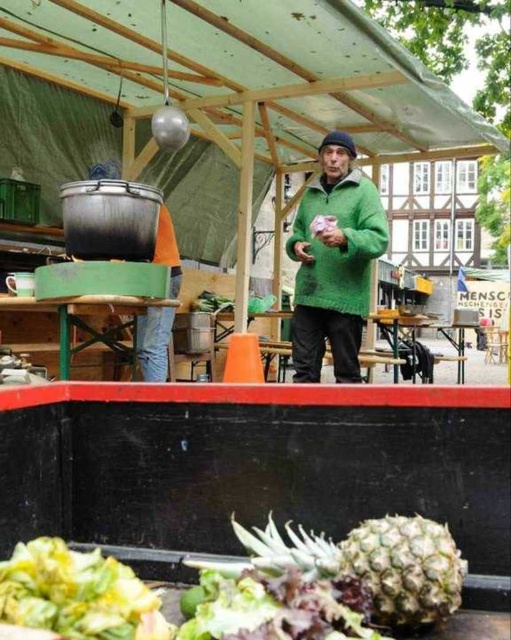
Does green rough pineapple at lower center have a greater height compared to jeans at center?

In fact, green rough pineapple at lower center may be shorter than jeans at center.

Is green rough pineapple at lower center shorter than jeans at center?

Correct, green rough pineapple at lower center is not as tall as jeans at center.

Is point (381, 520) more distant than point (169, 240)?

That is False.

At what (x,y) coordinates should I click in order to perform the action: click on green rough pineapple at lower center. Please return your answer as a coordinate pair (x, y). Looking at the image, I should click on (353, 579).

Can you confirm if green fuzzy sweater at center is smaller than green leafy vegetable at lower left?

Incorrect, green fuzzy sweater at center is not smaller in size than green leafy vegetable at lower left.

Who is shorter, green fuzzy sweater at center or green leafy vegetable at lower left?

green leafy vegetable at lower left is shorter.

Who is more forward, (322, 152) or (130, 586)?

Point (130, 586)

Locate an element on the screen. This screenshot has width=511, height=640. green fuzzy sweater at center is located at coordinates (334, 262).

Can you confirm if wooden table at center is positioned to the right of jeans at center?

Incorrect, wooden table at center is not on the right side of jeans at center.

Which is behind, point (68, 310) or point (167, 225)?

The point (167, 225) is more distant.

Identify the location of wooden table at center. (81, 316).

Identify the location of wooden table at center. click(x=81, y=316).